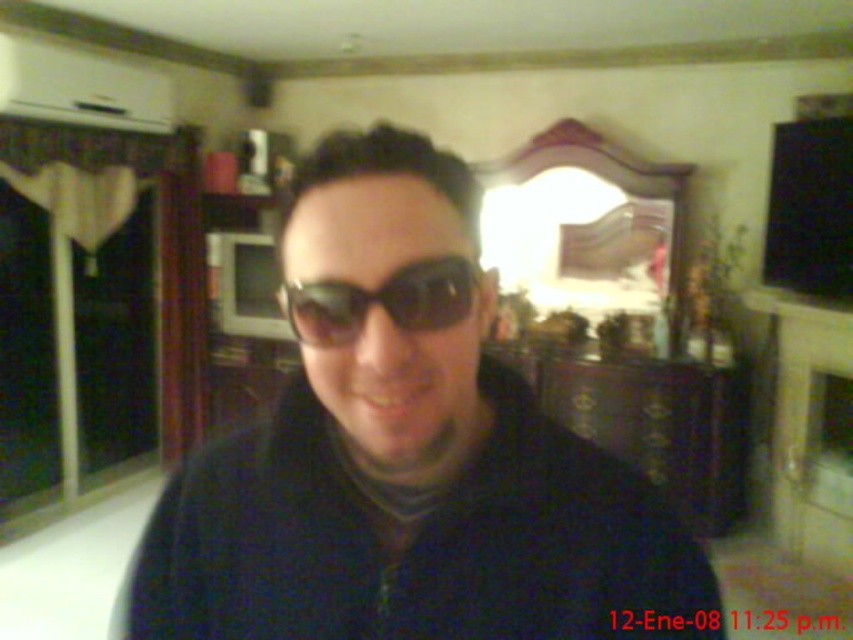
You are standing in the living room and see two pairs of sunglasses at the center. Which one is positioned lower between the black matte sunglasses at center and the black reflective sunglasses at center?

The black matte sunglasses at center is located below the black reflective sunglasses at center, so the black matte sunglasses at center is positioned lower.

You are standing in the living room and want to reach a specific point in the room to place a small decoration. The coordinates of this point are point (297, 260). Given that the distance from you to this point is 19.68 inches, can you comfortably place the decoration without moving closer?

The distance of point (297, 260) is 19.68 inches from the viewer, so yes, you can comfortably place the decoration at that distance without needing to move closer.

You are a photographer adjusting your camera settings. You notice the black matte sunglasses at center in the image. Based on their position, can you determine if they are closer to the top or bottom of the frame?

The black matte sunglasses at center are located at point [405,452] in the 2D frame. Since the y coordinate is 0.477, which is closer to 0.5, they are near the center vertically and not significantly closer to the top or bottom.